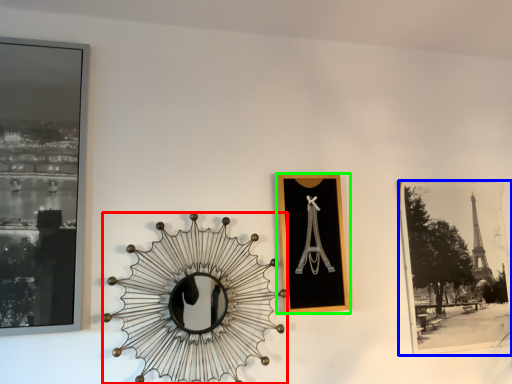
Question: Which object is the farthest from design (highlighted by a red box)? Choose among these: picture frame (highlighted by a blue box) or picture frame (highlighted by a green box).

Choices:
 (A) picture frame
 (B) picture frame

Answer: (A)